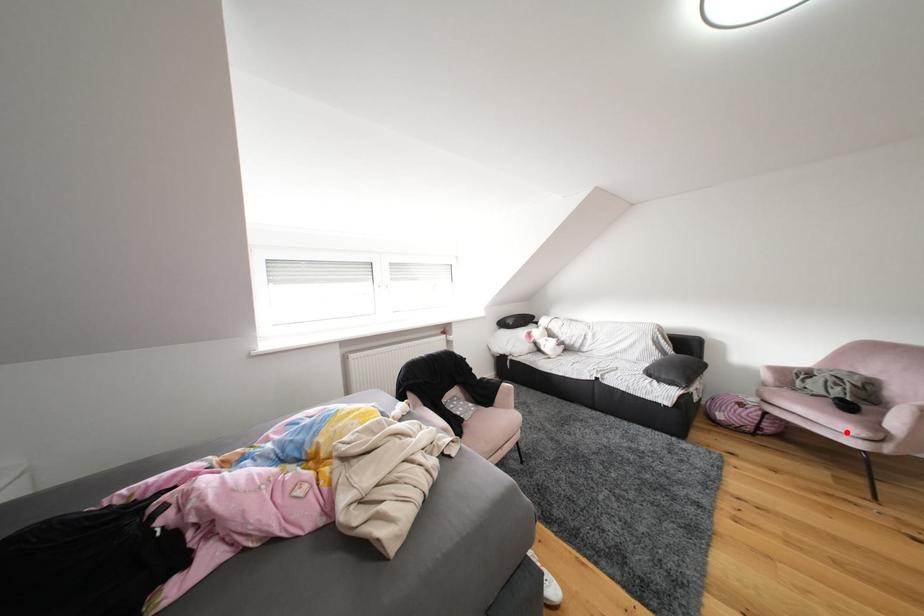
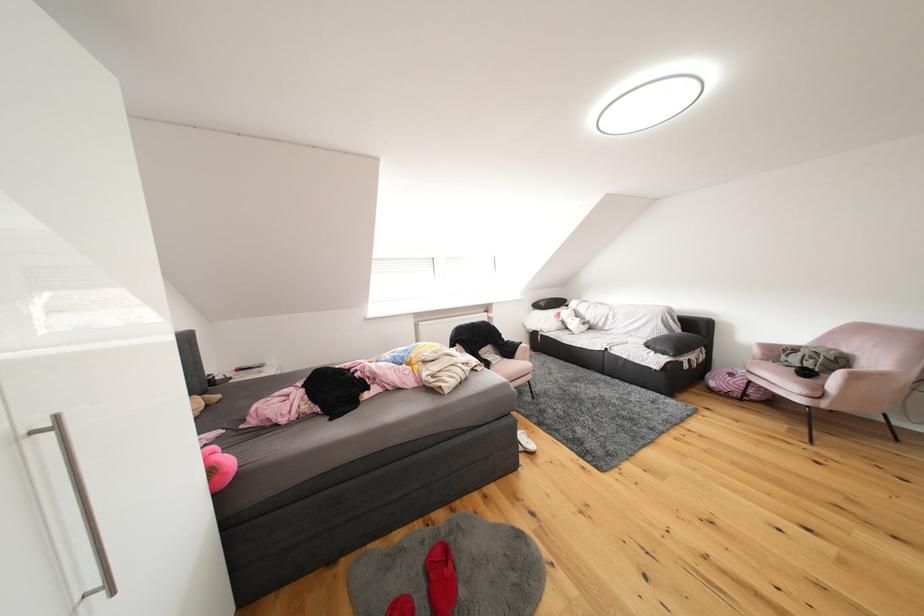
Locate, in the second image, the point that corresponds to the highlighted location in the first image.

(797, 392)